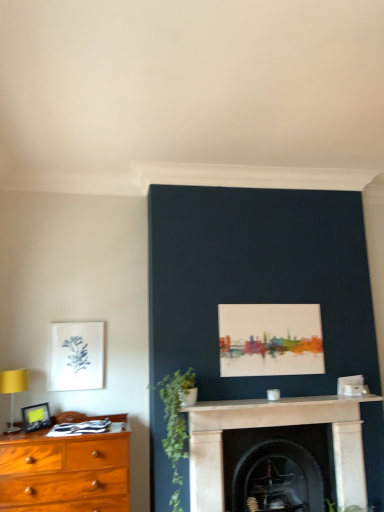
Where is `free location above white marble mantle at center (from a real-world perspective)`? The height and width of the screenshot is (512, 384). free location above white marble mantle at center (from a real-world perspective) is located at coordinates (266, 401).